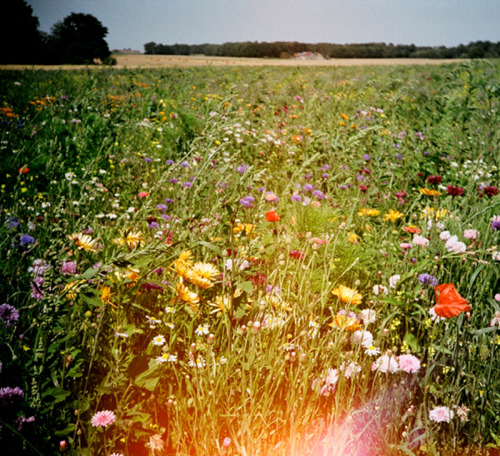
At what (x,y) coordinates should I click in order to perform the action: click on light. Please return your answer as a coordinate pair (x, y). The width and height of the screenshot is (500, 456). Looking at the image, I should click on (268, 369).